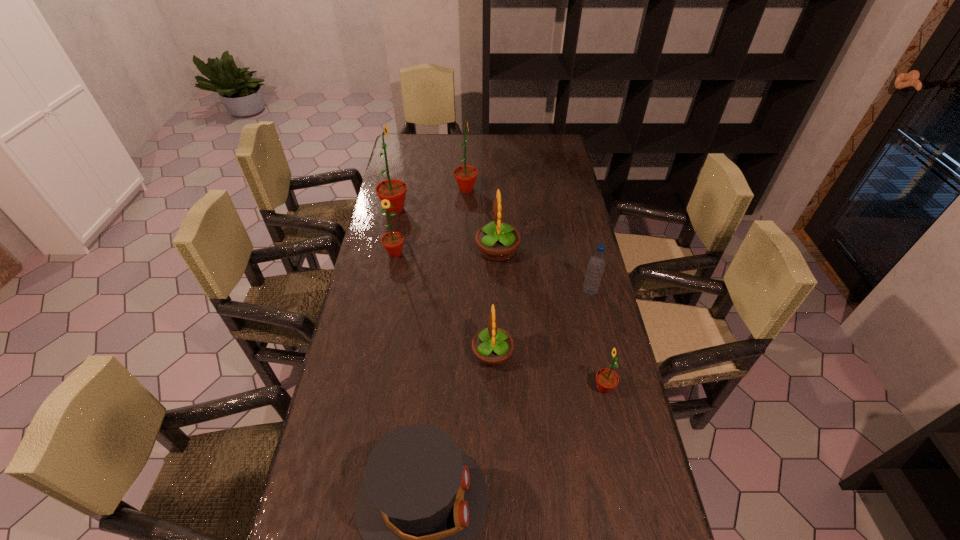
Identify the location of blank area located on the face of the nearer yellow sunflower. The height and width of the screenshot is (540, 960). (377, 354).

Identify the location of free space located 0.230m on the face of the nearer yellow sunflower. (392, 354).

In order to click on free spot located on the face of the second nearest object in this screenshot , I will do `click(496, 388)`.

This screenshot has height=540, width=960. I want to click on vacant space positioned 0.310m on the face of the second nearest object, so click(477, 388).

Find the location of a particular element. vacant space located on the face of the second nearest object is located at coordinates (474, 388).

At what (x,y) coordinates should I click in order to perform the action: click on water bottle that is positioned at the right edge. Please return your answer as a coordinate pair (x, y). Image resolution: width=960 pixels, height=540 pixels. Looking at the image, I should click on (596, 264).

The image size is (960, 540). I want to click on sunflower located at the right edge, so click(606, 379).

I want to click on vacant space at the far edge of the desktop, so click(x=511, y=136).

Image resolution: width=960 pixels, height=540 pixels. In the image, there is a desktop. Identify the location of vacant space at the left edge. (379, 300).

This screenshot has height=540, width=960. I want to click on vacant space at the right edge of the desktop, so click(582, 470).